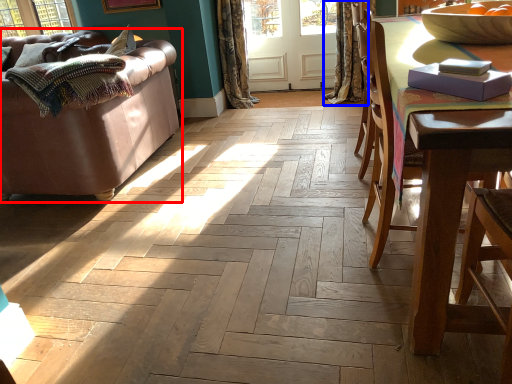
Question: Among these objects, which one is nearest to the camera, studio couch (highlighted by a red box) or curtain (highlighted by a blue box)?

Choices:
 (A) studio couch
 (B) curtain

Answer: (A)